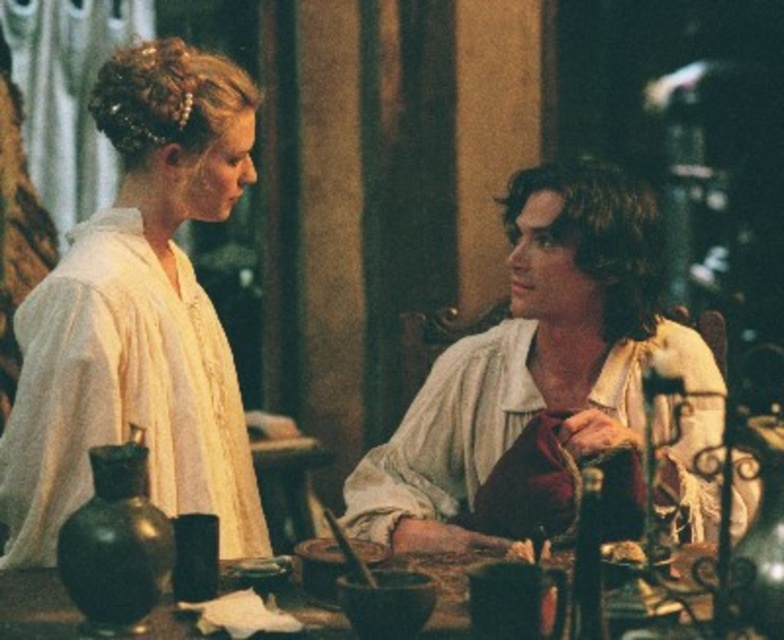
You are standing in front of the table with two points marked on it. You need to determine which point is closer to you. The points are labeled as point [634,422] and point [686,563]. Based on the scene description, which point is closer to your position?

Point [634,422] is closer to you because it is further to the viewer than point [686,563] according to the description.

You are an actor standing in the middle of the stage and you need to hand a letter to the matte white blouse at upper left and the wooden table at center. Which one should you approach first?

You should approach the matte white blouse at upper left first because it is closer to you than the wooden table at center.